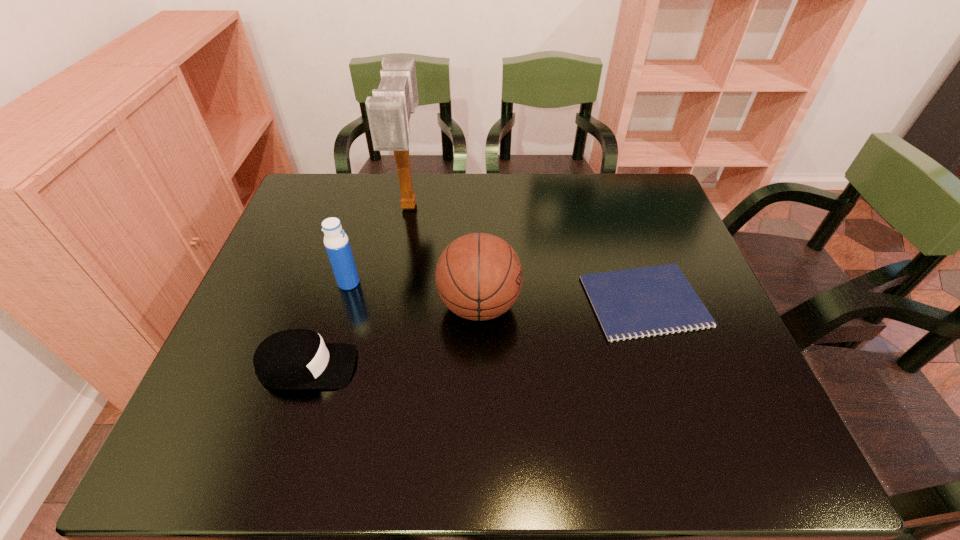
Find the location of a particular element. mallet is located at coordinates (389, 110).

Image resolution: width=960 pixels, height=540 pixels. I want to click on the tallest object, so click(389, 110).

Where is `the fourth object from left to right`? The width and height of the screenshot is (960, 540). the fourth object from left to right is located at coordinates (479, 276).

The height and width of the screenshot is (540, 960). What are the coordinates of `water bottle` in the screenshot? It's located at (336, 242).

Identify the location of the fourth tallest object. (292, 359).

Find the location of `cap`. cap is located at coordinates pyautogui.click(x=292, y=359).

Locate an element on the screen. the rightmost object is located at coordinates (648, 301).

Where is `the shortest object`? The width and height of the screenshot is (960, 540). the shortest object is located at coordinates (648, 301).

This screenshot has width=960, height=540. In order to click on vacant area situated 0.110m on the left of the farthest object in this screenshot , I will do `click(360, 205)`.

Where is `vacant space situated on the side with brand label of the basketball`? The width and height of the screenshot is (960, 540). vacant space situated on the side with brand label of the basketball is located at coordinates (606, 305).